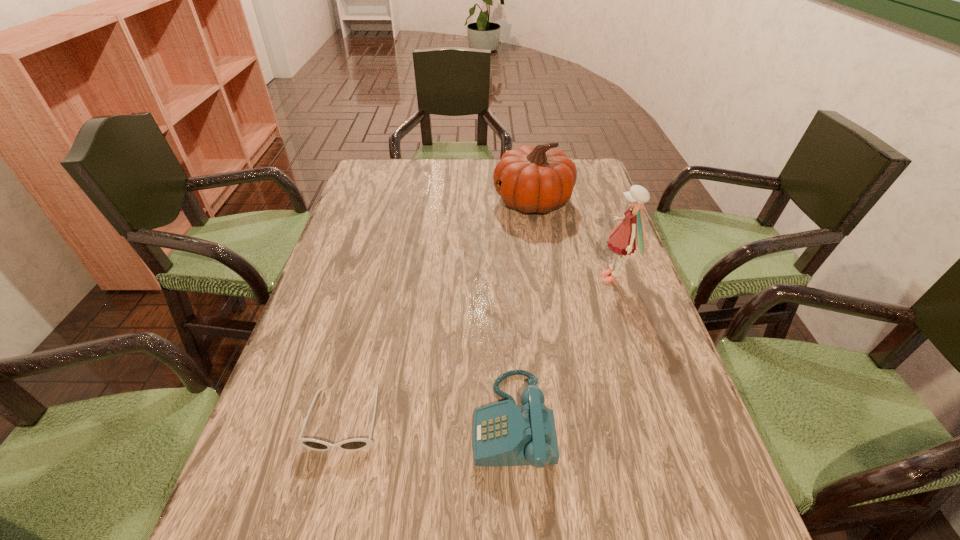
You are a GUI agent. You are given a task and a screenshot of the screen. Output one action in this format:
    pyautogui.click(x=<x>, y=<y>)
    Task: Click on the vacant space that satisfies the following two spatial constraints: 1. on the face of the farthest object; 2. with the lenses of the shortest object facing outward
    This screenshot has height=540, width=960.
    Given the screenshot: What is the action you would take?
    pyautogui.click(x=568, y=420)

Locate an element on the screen. This screenshot has width=960, height=540. vacant region that satisfies the following two spatial constraints: 1. on the face of the second tallest object; 2. with the lenses of the sunglasses facing outward is located at coordinates (568, 420).

Locate an element on the screen. free space that satisfies the following two spatial constraints: 1. on the face of the third shortest object; 2. with the lenses of the shortest object facing outward is located at coordinates (568, 420).